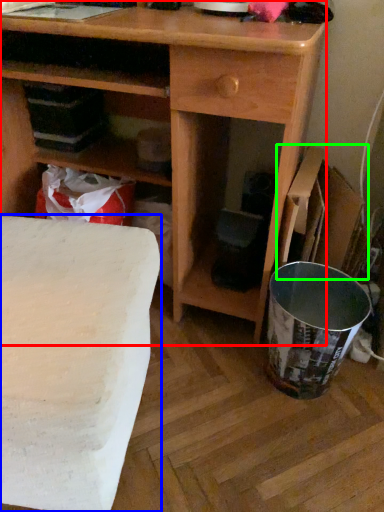
Question: Based on their relative distances, which object is farther from desk (highlighted by a red box)? Choose from table (highlighted by a blue box) and cardboard box (highlighted by a green box).

Choices:
 (A) table
 (B) cardboard box

Answer: (A)